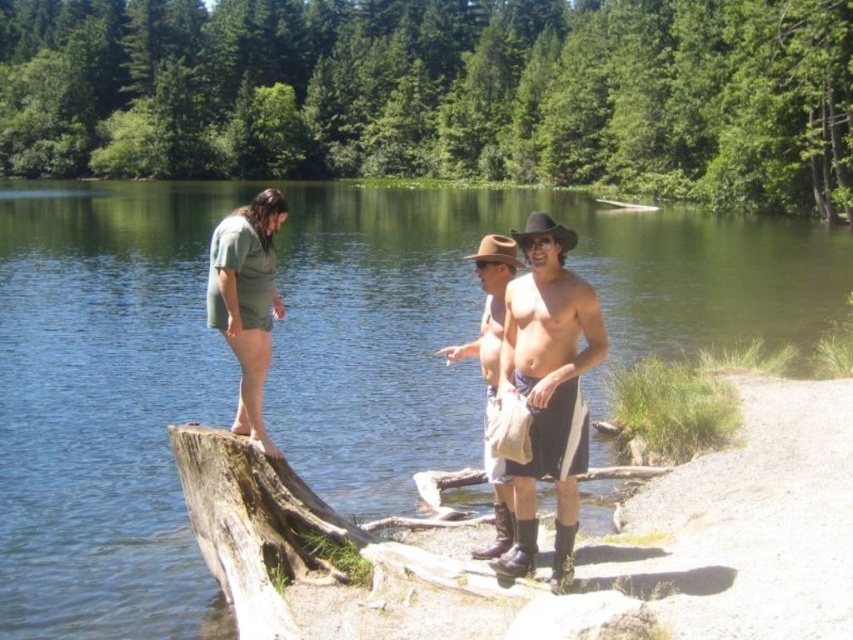
Question: Which is farther from the shiny metallic shorts at center?

Choices:
 (A) brown leather cowboy boots at center
 (B) brown rough wood log at lower center

Answer: (A)

Question: Can you confirm if shiny metallic shorts at center is positioned above brown leather cowboy boots at center?

Choices:
 (A) no
 (B) yes

Answer: (A)

Question: Can you confirm if green matte shorts at left is thinner than brown leather cowboy boots at center?

Choices:
 (A) no
 (B) yes

Answer: (A)

Question: Is brown rough wood log at lower center smaller than brown leather cowboy boots at center?

Choices:
 (A) yes
 (B) no

Answer: (A)

Question: Which point appears closest to the camera in this image?

Choices:
 (A) (489, 452)
 (B) (466, 588)

Answer: (B)

Question: Which object is positioned farthest from the clear water at lake center?

Choices:
 (A) shiny metallic shorts at center
 (B) brown leather cowboy boots at center
 (C) green matte shorts at left

Answer: (A)